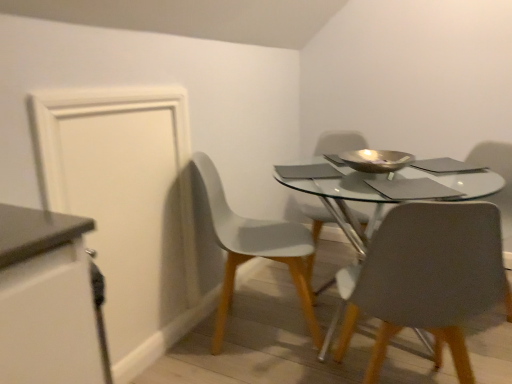
Question: Considering the relative sizes of metallic gold bowl at center and white matte chair at lower left, the second chair when ordered from front to back, in the image provided, is metallic gold bowl at center shorter than white matte chair at lower left, the second chair when ordered from front to back,?

Choices:
 (A) no
 (B) yes

Answer: (B)

Question: Would you say metallic gold bowl at center contains white matte chair at lower left, the second chair when ordered from front to back?

Choices:
 (A) no
 (B) yes

Answer: (A)

Question: Is metallic gold bowl at center thinner than white matte chair at lower left, which appears as the second chair when viewed from the back?

Choices:
 (A) no
 (B) yes

Answer: (B)

Question: Can you confirm if metallic gold bowl at center is positioned to the left of white matte chair at lower left, the second chair when ordered from front to back?

Choices:
 (A) yes
 (B) no

Answer: (B)

Question: Is metallic gold bowl at center completely or partially outside of white matte chair at lower left, the second chair when ordered from front to back?

Choices:
 (A) yes
 (B) no

Answer: (A)

Question: From a real-world perspective, is white matte door at left above or below matte gray chair at center, which is counted as the 1th chair, starting from the back?

Choices:
 (A) above
 (B) below

Answer: (A)

Question: From the image's perspective, is white matte door at left positioned above or below matte gray chair at center, marked as the 3th chair in a front-to-back arrangement?

Choices:
 (A) below
 (B) above

Answer: (A)

Question: In the image, is white matte door at left positioned in front of or behind matte gray chair at center, marked as the 3th chair in a front-to-back arrangement?

Choices:
 (A) behind
 (B) front

Answer: (B)

Question: Is point (132, 160) positioned closer to the camera than point (315, 148)?

Choices:
 (A) farther
 (B) closer

Answer: (B)

Question: From the image's perspective, is matte gray chair at center, acting as the 3th chair starting from the back, located above or below metallic gold bowl at center?

Choices:
 (A) below
 (B) above

Answer: (A)

Question: Is matte gray chair at center, the 1th chair viewed from the front, wider or thinner than metallic gold bowl at center?

Choices:
 (A) thin
 (B) wide

Answer: (B)

Question: From a real-world perspective, relative to metallic gold bowl at center, is matte gray chair at center, the 1th chair viewed from the front, vertically above or below?

Choices:
 (A) above
 (B) below

Answer: (B)

Question: In terms of size, does matte gray chair at center, the 1th chair viewed from the front, appear bigger or smaller than metallic gold bowl at center?

Choices:
 (A) big
 (B) small

Answer: (A)

Question: From a real-world perspective, is matte gray chair at center, the 1th chair viewed from the front, above or below white matte cabinet at left?

Choices:
 (A) below
 (B) above

Answer: (A)

Question: Considering the positions of matte gray chair at center, acting as the 3th chair starting from the back, and white matte cabinet at left in the image, is matte gray chair at center, acting as the 3th chair starting from the back, taller or shorter than white matte cabinet at left?

Choices:
 (A) short
 (B) tall

Answer: (B)